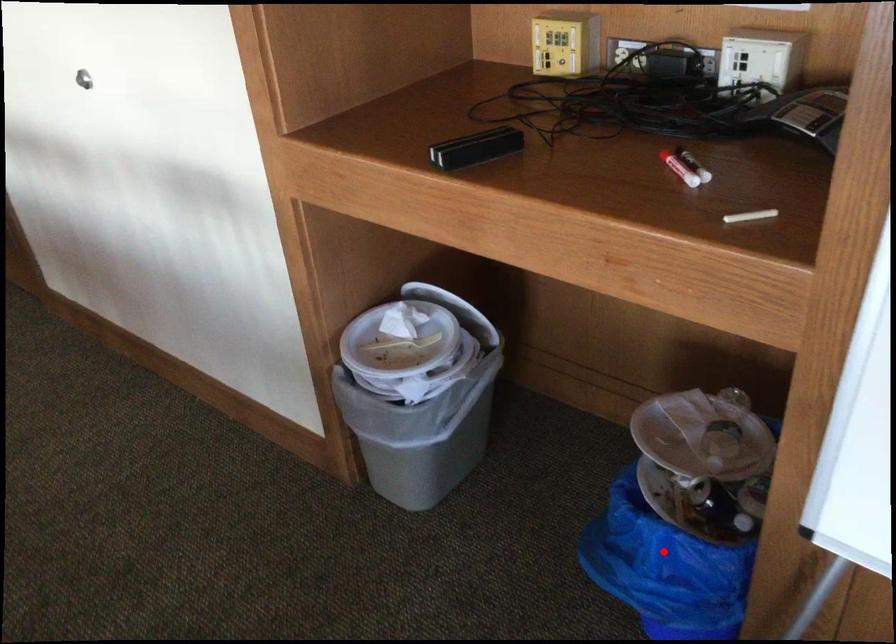
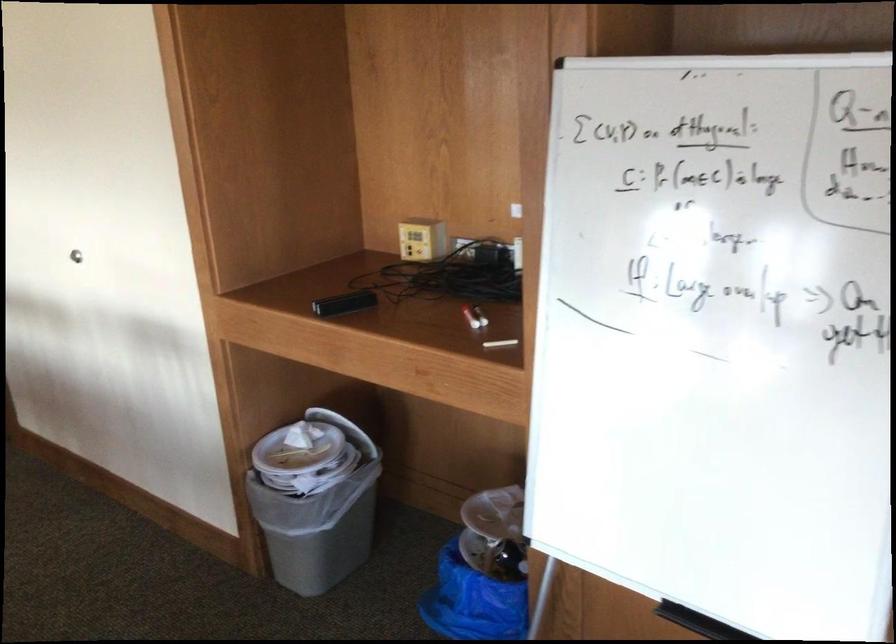
Where in the second image is the point corresponding to the highlighted location from the first image?

(472, 601)